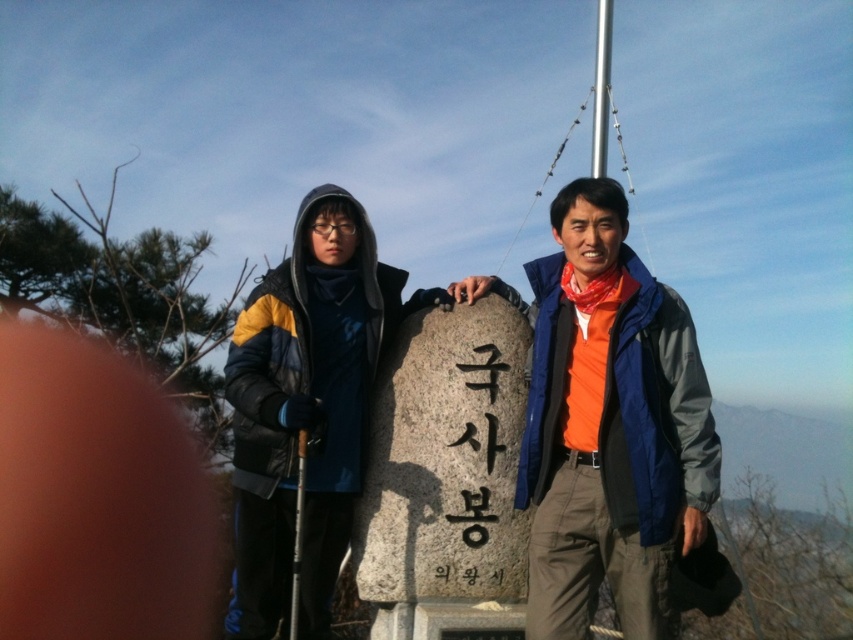
Is black stone at center further to the viewer compared to matte black ski pole at center?

That is True.

Is point (486, 440) in front of point (300, 516)?

No.

This screenshot has width=853, height=640. I want to click on black stone at center, so click(474, 516).

Image resolution: width=853 pixels, height=640 pixels. I want to click on gray stone at center, so click(x=445, y=460).

This screenshot has height=640, width=853. I want to click on gray stone at center, so click(445, 460).

How far apart are orange fabric scarf at center and matte black ski pole at center?

orange fabric scarf at center is 3.14 meters away from matte black ski pole at center.

Can you confirm if orange fabric scarf at center is positioned above matte black ski pole at center?

Yes, orange fabric scarf at center is above matte black ski pole at center.

Locate an element on the screen. Image resolution: width=853 pixels, height=640 pixels. orange fabric scarf at center is located at coordinates (610, 428).

Identify the location of orange fabric scarf at center. The width and height of the screenshot is (853, 640). click(x=610, y=428).